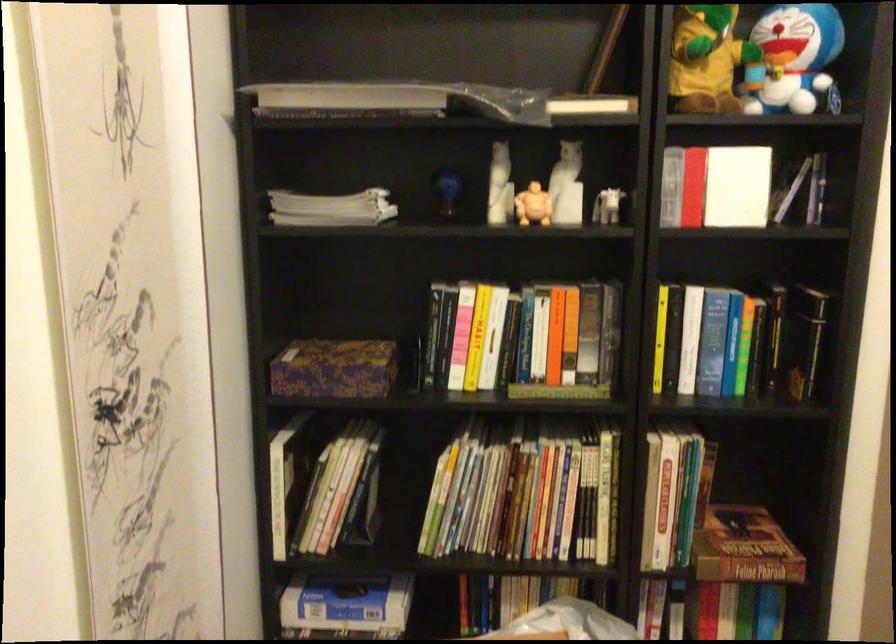
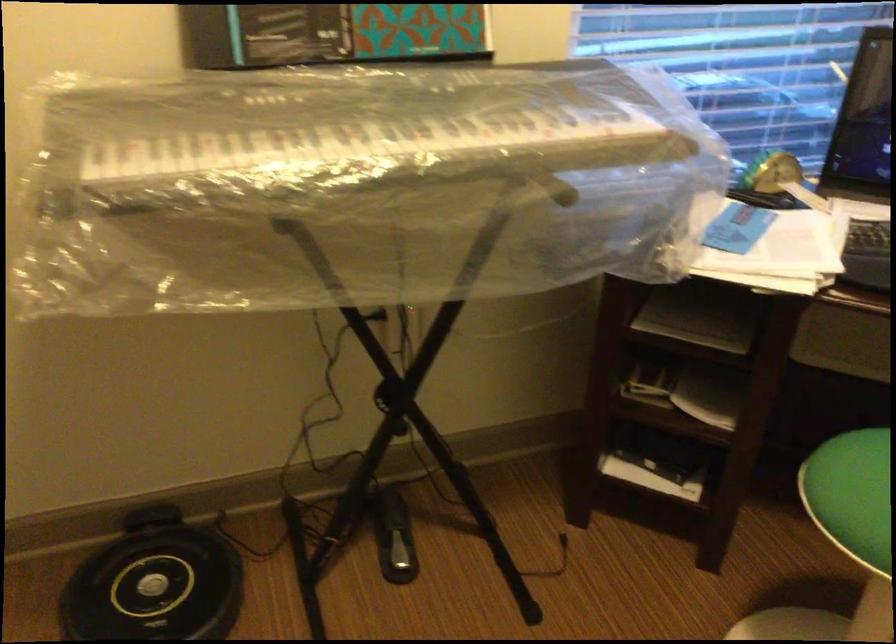
The first image is from the beginning of the video and the second image is from the end. How did the camera likely rotate when shooting the video?

The rotation direction of the camera is right-down.